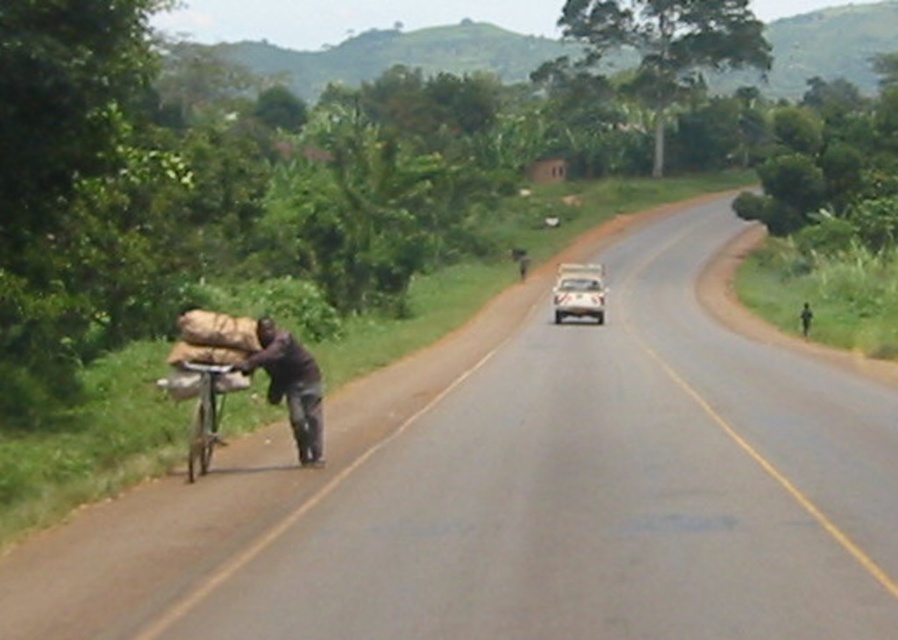
Question: Does dark brown fabric at left lie behind white glossy car at center?

Choices:
 (A) no
 (B) yes

Answer: (A)

Question: Is metallic silver bicycle at left behind white glossy car at center?

Choices:
 (A) yes
 (B) no

Answer: (B)

Question: Which of the following is the closest to the observer?

Choices:
 (A) (199, 394)
 (B) (566, 298)
 (C) (318, 374)

Answer: (A)

Question: Which of the following is the farthest from the observer?

Choices:
 (A) metallic silver bicycle at left
 (B) white glossy car at center
 (C) dark brown fabric at left

Answer: (B)

Question: Can you confirm if dark brown fabric at left is thinner than white glossy car at center?

Choices:
 (A) no
 (B) yes

Answer: (B)

Question: Which of the following is the farthest from the observer?

Choices:
 (A) (568, 273)
 (B) (304, 464)

Answer: (A)